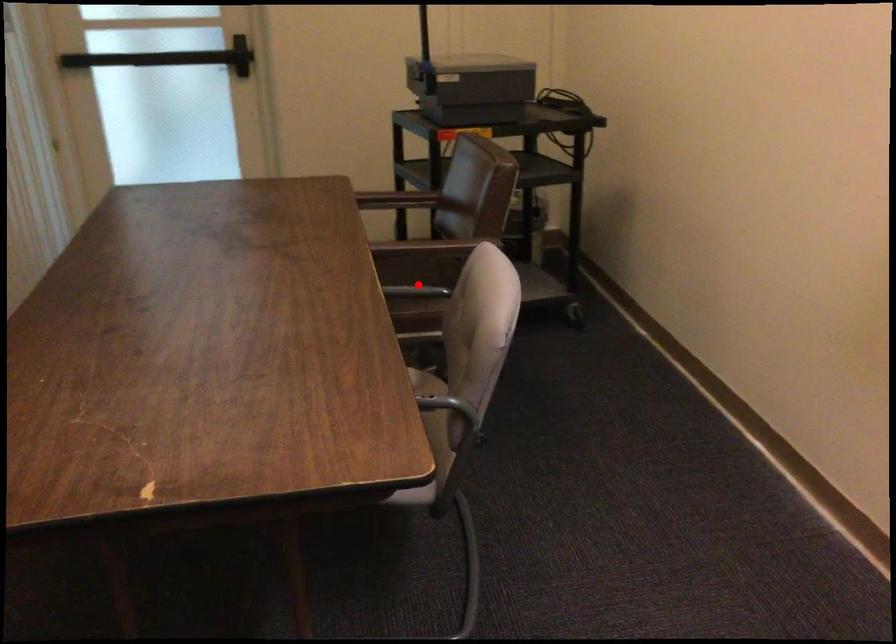
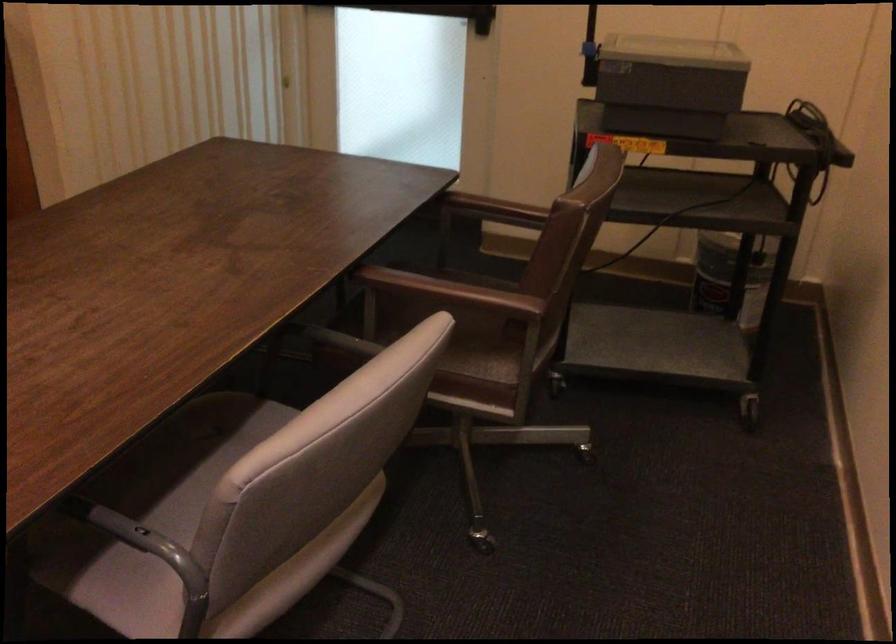
Question: I am providing you with two images of the same scene from different viewpoints. Given a red point in image1, look at the same physical point in image2. Is it:

Choices:
 (A) Closer to the viewpoint
 (B) Farther from the viewpoint

Answer: (A)